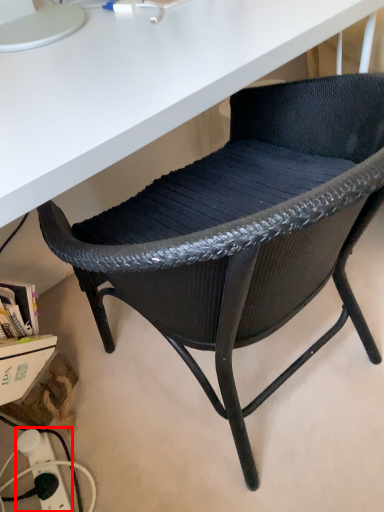
Question: In this image, where is electric outlet (annotated by the red box) located relative to chair?

Choices:
 (A) right
 (B) left

Answer: (B)